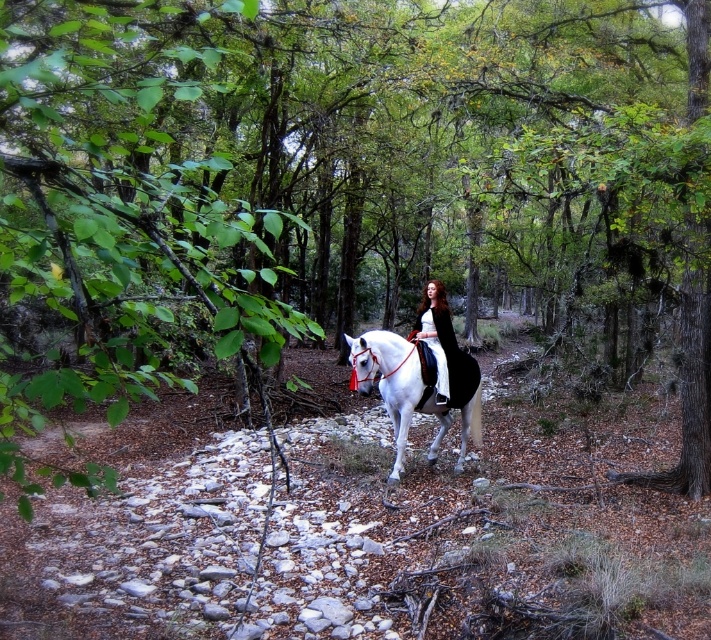
Question: Which point is farther from the camera taking this photo?

Choices:
 (A) (466, 420)
 (B) (433, 346)

Answer: (A)

Question: Which point is farther to the camera?

Choices:
 (A) (370, 348)
 (B) (434, 349)

Answer: (B)

Question: Does white glossy horse at center lie in front of velvet black coat at center?

Choices:
 (A) no
 (B) yes

Answer: (B)

Question: Can you confirm if white glossy horse at center is positioned below velvet black coat at center?

Choices:
 (A) no
 (B) yes

Answer: (B)

Question: Does white glossy horse at center have a smaller size compared to velvet black coat at center?

Choices:
 (A) no
 (B) yes

Answer: (A)